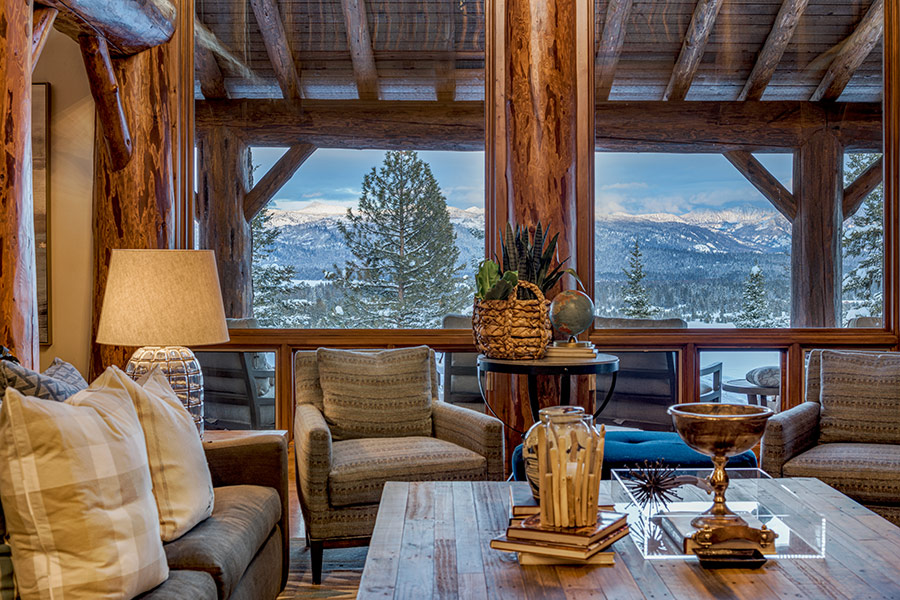
At what (x,y) coordinates should I click in order to perform the action: click on brown chairs. Please return your answer as a coordinate pair (x, y). This screenshot has width=900, height=600. Looking at the image, I should click on (860, 413), (371, 402).